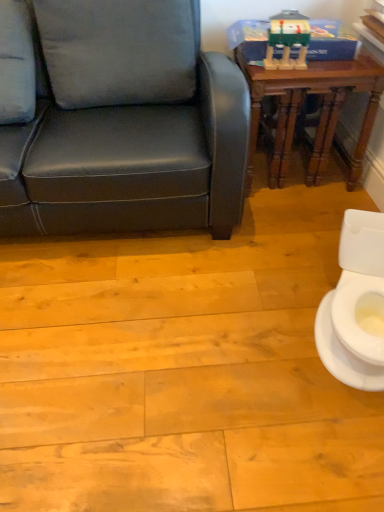
At what (x,y) coordinates should I click in order to perform the action: click on free space between wooden table at upper right and white glossy toilet at lower right. Please return your answer as a coordinate pair (x, y). Looking at the image, I should click on (291, 239).